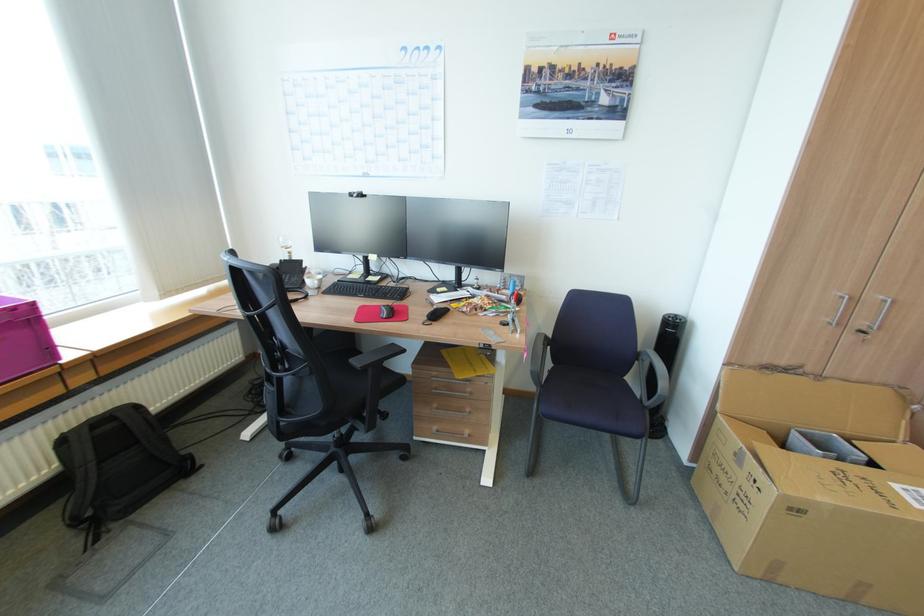
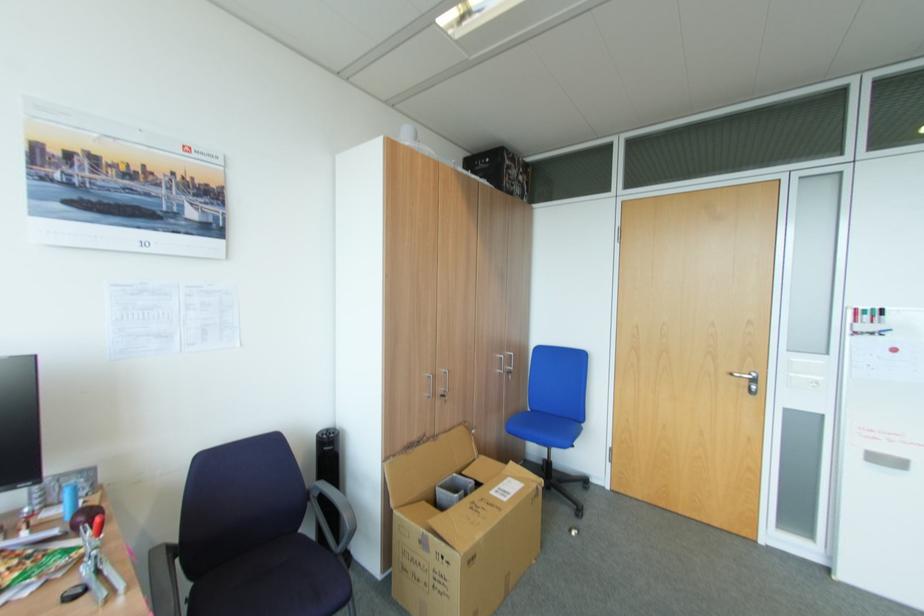
Where in the second image is the point corresponding to pixel 846 323 from the first image?

(440, 394)